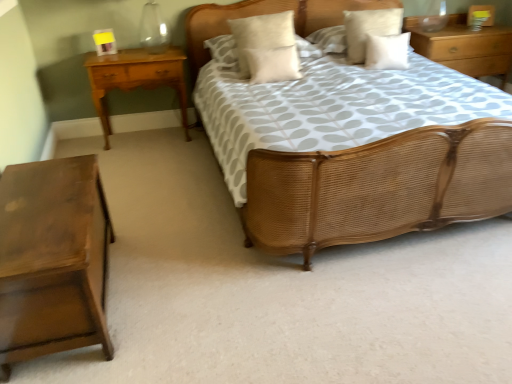
Question: Does point (137, 54) appear closer or farther from the camera than point (356, 218)?

Choices:
 (A) farther
 (B) closer

Answer: (A)

Question: In terms of width, does light brown wood nightstand at left, which appears as the 2th nightstand when ordered from the bottom, look wider or thinner when compared to woven wood bed at center?

Choices:
 (A) thin
 (B) wide

Answer: (A)

Question: Which object is the farthest from the wooden nightstand at upper right, the 3th nightstand from the left?

Choices:
 (A) woven wood bed at center
 (B) light brown wood nightstand at left, placed as the third nightstand when sorted from right to left
 (C) white soft pillow at center, which is the third pillow from left to right
 (D) white soft pillow at upper right, the first pillow in the right-to-left sequence
 (E) dark brown wood nightstand at lower left, which ranks as the 2th nightstand in right-to-left order

Answer: (E)

Question: Which object is the farthest from the dark brown wood nightstand at lower left, placed as the 1th nightstand when sorted from front to back?

Choices:
 (A) light brown wood nightstand at left, arranged as the second nightstand when viewed from the top
 (B) white soft pillow at center, the 3th pillow from the right
 (C) white soft pillow at upper right, the fifth pillow when ordered from left to right
 (D) wooden nightstand at upper right, the 3th nightstand from the front
 (E) white soft cushion at center, the fourth pillow in the right-to-left sequence

Answer: (D)